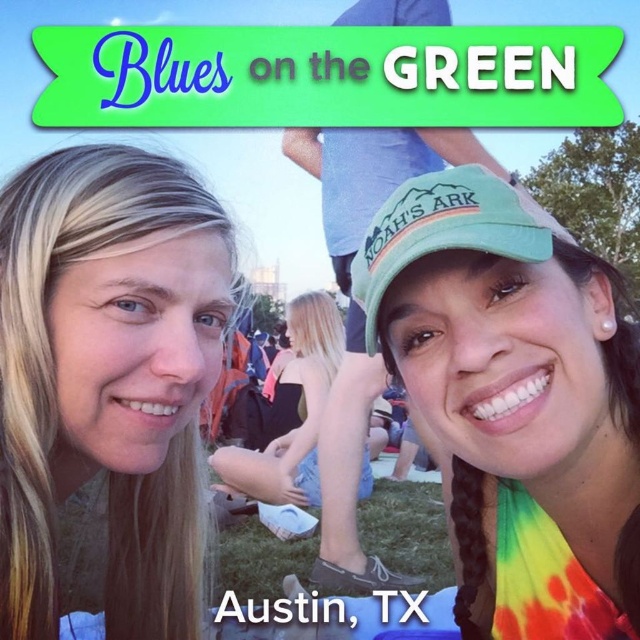
Who is more distant from viewer, (40, 314) or (378, 296)?

The point (378, 296) is behind.

Is blonde hair at left below green fabric baseball cap at center?

Yes, blonde hair at left is below green fabric baseball cap at center.

Does point (198, 632) come in front of point (433, 250)?

No, (198, 632) is further to viewer.

Identify the location of blonde hair at left. The width and height of the screenshot is (640, 640). (108, 381).

Which is below, green fabric cap at right or green fabric baseball cap at center?

green fabric cap at right is lower down.

Does green fabric cap at right appear on the left side of green fabric baseball cap at center?

In fact, green fabric cap at right is to the right of green fabric baseball cap at center.

Is point (371, 292) farther from viewer compared to point (376, 294)?

Yes, it is.

Identify the location of green fabric cap at right. (515, 401).

Between blonde hair at left and green fabric cap at right, which one is positioned lower?

blonde hair at left is below.

Which is more to the right, blonde hair at left or green fabric cap at right?

Positioned to the right is green fabric cap at right.

Does point (122, 632) come in front of point (532, 452)?

No, (122, 632) is behind (532, 452).

You are a GUI agent. You are given a task and a screenshot of the screen. Output one action in this format:
    pyautogui.click(x=<x>, y=<y>)
    Task: Click on the blonde hair at left
    This screenshot has height=640, width=640.
    Given the screenshot: What is the action you would take?
    pyautogui.click(x=108, y=381)